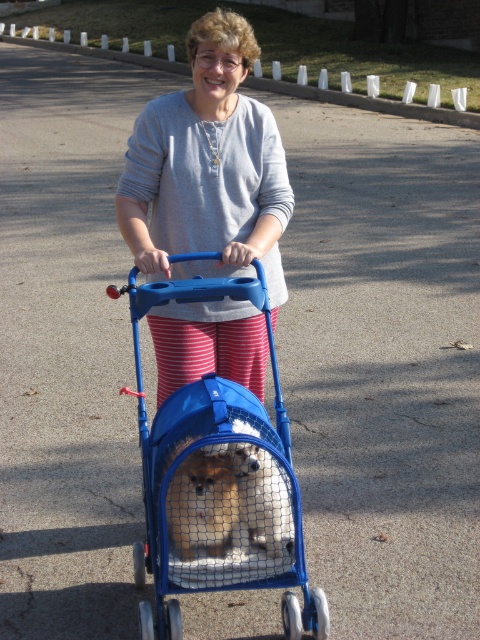
Which is in front, point (241, 77) or point (240, 556)?

Point (240, 556) is more forward.

Which is behind, point (247, 256) or point (200, 403)?

Point (247, 256)

Identify the location of gray cotton sweater at center. (207, 166).